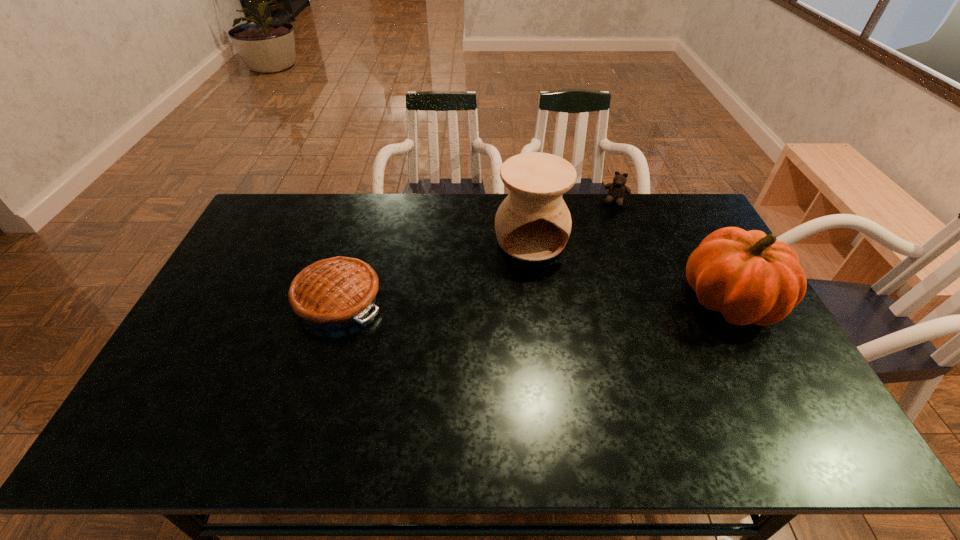
Image resolution: width=960 pixels, height=540 pixels. I want to click on vacant space positioned 0.240m at the open side of the second farthest object, so click(554, 321).

Locate an element on the screen. The image size is (960, 540). vacant space located 0.210m on the face of the teddy bear is located at coordinates (601, 241).

You are a GUI agent. You are given a task and a screenshot of the screen. Output one action in this format:
    pyautogui.click(x=<x>, y=<y>)
    Task: Click on the vacant area situated on the face of the teddy bear
    Image resolution: width=960 pixels, height=540 pixels.
    Given the screenshot: What is the action you would take?
    point(609,221)

Where is `vacant space located on the face of the teddy bear`? The width and height of the screenshot is (960, 540). vacant space located on the face of the teddy bear is located at coordinates (588, 275).

Locate an element on the screen. pottery that is at the far edge is located at coordinates (533, 223).

At what (x,y) coordinates should I click in order to perform the action: click on teddy bear that is at the far edge. Please return your answer as a coordinate pair (x, y). This screenshot has width=960, height=540. Looking at the image, I should click on (617, 190).

The height and width of the screenshot is (540, 960). Find the location of `object that is at the right edge`. object that is at the right edge is located at coordinates (750, 277).

What are the coordinates of `free point at the far edge` in the screenshot? It's located at (631, 202).

Find the location of a particular element. vacant region at the near edge of the desktop is located at coordinates click(x=509, y=402).

In the image, there is a desktop. Identify the location of vacant space at the left edge. (258, 239).